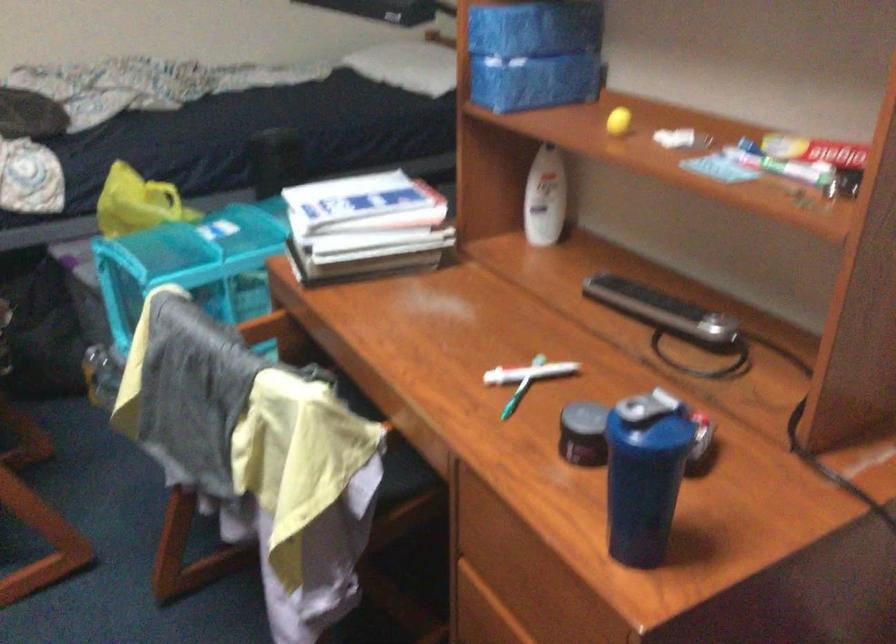
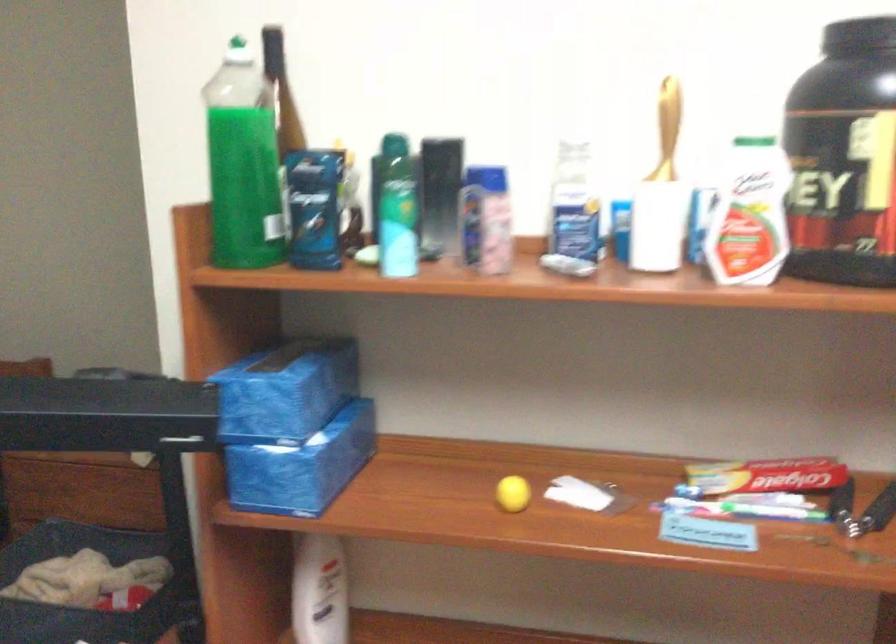
The point at (614, 120) is marked in the first image. Where is the corresponding point in the second image?

(513, 494)